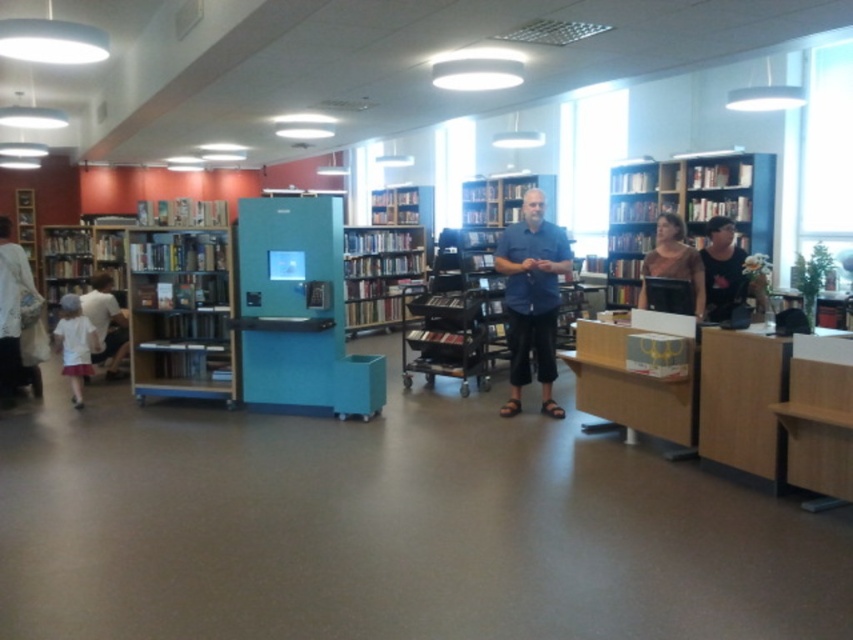
You are a librarian who needs to place a new book on the highest shelf of the wooden bookcase at right. You are wearing a black tank top at right. Can you reach the top shelf without any assistance?

The wooden bookcase at right has a greater height compared to black tank top at right, so you cannot reach the top shelf without assistance.

You are a customer in a clothing store and want to try on the black tank top at right and the matte pink shirt at center. The fitting room is located behind the teal display machine. Can you walk between the two shirts to reach the fitting room without moving them?

The black tank top at right is 22.25 centimeters away from the matte pink shirt at center. Since this distance is too narrow for a person to walk through comfortably, you cannot reach the fitting room by walking between the two shirts without moving them.

You are a customer in a clothing store and see the black tank top at right and the matte pink shirt at center. Which one is shorter in height?

The black tank top at right has a lesser height compared to the matte pink shirt at center, so the black tank top at right is shorter.